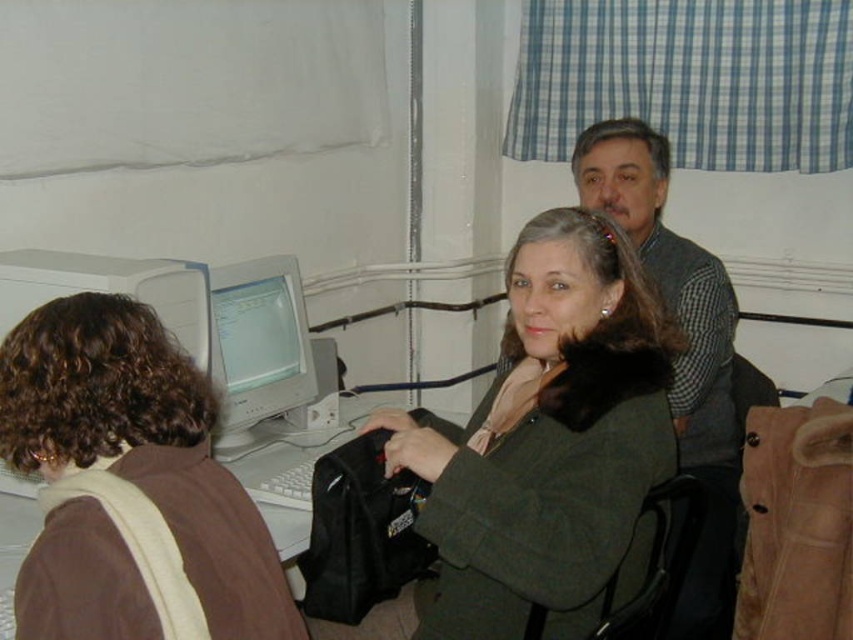
You are organizing a small event and need to decide where to place a 1.2 meter tall decoration. Based on the image, which object would you place it next to, the gray wool sweater at upper right or the matte gray monitor at center, and why?

The gray wool sweater at upper right is taller than the matte gray monitor at center. Since the decoration is 1.2 meters tall, it would be more appropriately placed next to the taller object, the gray wool sweater at upper right, to maintain visual balance.

You are organizing a small event and need to place a decorative tablecloth that is 1.2 meters wide. You have two options in the room, the gray wool sweater at upper right and the matte gray monitor at center. Which object would the tablecloth fit over without hanging off the edges?

The gray wool sweater at upper right might be wider than matte gray monitor at center, so the tablecloth would fit better over the gray wool sweater at upper right since it is wider than the matte gray monitor at center.

In the scene described, there are two coats present. The green woolen coat at center and the brown fuzzy jacket at left. Which of these two coats is positioned closer to the right side of the image?

The green woolen coat at center is positioned to the right of the brown fuzzy jacket at left, so it is closer to the right side of the image.